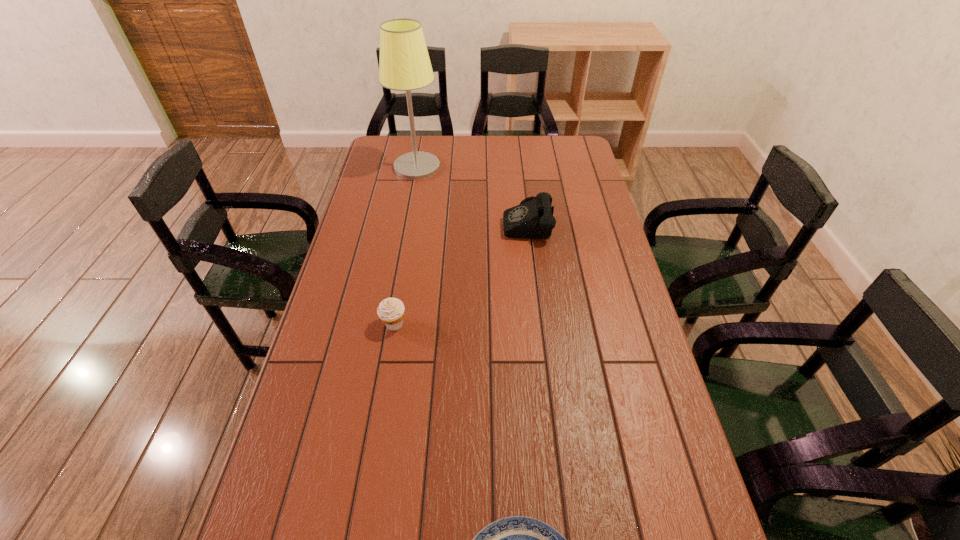
I want to click on object that is positioned at the left edge, so click(x=405, y=65).

You are a GUI agent. You are given a task and a screenshot of the screen. Output one action in this format:
    pyautogui.click(x=<x>, y=<y>)
    Task: Click on the object located in the far left corner section of the desktop
    Image resolution: width=960 pixels, height=540 pixels.
    Given the screenshot: What is the action you would take?
    pyautogui.click(x=405, y=65)

In the image, there is a desktop. At what (x,y) coordinates should I click in order to perform the action: click on vacant space at the left edge. Please return your answer as a coordinate pair (x, y). The width and height of the screenshot is (960, 540). Looking at the image, I should click on (365, 348).

Where is `free space at the right edge of the desktop`? This screenshot has height=540, width=960. free space at the right edge of the desktop is located at coordinates (571, 226).

In the image, there is a desktop. Where is `vacant area at the far left corner`? vacant area at the far left corner is located at coordinates (379, 136).

I want to click on free location at the far right corner of the desktop, so click(568, 146).

Locate an element on the screen. Image resolution: width=960 pixels, height=540 pixels. free point between the farthest object and the telephone is located at coordinates point(471,194).

Where is `vacant space that's between the third nearest object and the table lamp`? The height and width of the screenshot is (540, 960). vacant space that's between the third nearest object and the table lamp is located at coordinates (471, 194).

Locate an element on the screen. Image resolution: width=960 pixels, height=540 pixels. unoccupied area between the farthest object and the third farthest object is located at coordinates (405, 246).

The height and width of the screenshot is (540, 960). What are the coordinates of `unoccupied position between the tallest object and the telephone` in the screenshot? It's located at (471, 194).